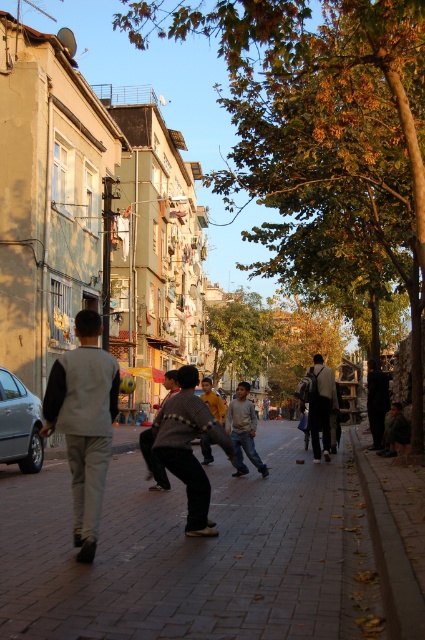
Question: Which point is farther to the camera?

Choices:
 (A) light gray vest at center
 (B) brick pavement at center

Answer: (A)

Question: Does brick pavement at center have a greater width compared to light gray vest at center?

Choices:
 (A) yes
 (B) no

Answer: (A)

Question: Which of the following is the farthest from the observer?

Choices:
 (A) brick pavement at center
 (B) light gray vest at center

Answer: (B)

Question: Where is brick pavement at center located in relation to light gray vest at center in the image?

Choices:
 (A) below
 (B) above

Answer: (A)

Question: Where is brick pavement at center located in relation to light gray vest at center in the image?

Choices:
 (A) above
 (B) below

Answer: (B)